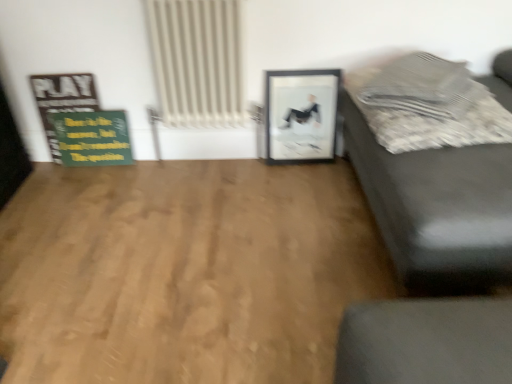
Question: Considering the relative sizes of textured gray pillow at upper right and matte black couch at right in the image provided, is textured gray pillow at upper right bigger than matte black couch at right?

Choices:
 (A) no
 (B) yes

Answer: (A)

Question: Does textured gray pillow at upper right have a greater width compared to matte black couch at right?

Choices:
 (A) no
 (B) yes

Answer: (A)

Question: Does textured gray pillow at upper right come behind matte black couch at right?

Choices:
 (A) yes
 (B) no

Answer: (A)

Question: Is textured gray pillow at upper right facing away from matte black couch at right?

Choices:
 (A) no
 (B) yes

Answer: (B)

Question: From a real-world perspective, is textured gray pillow at upper right physically above matte black couch at right?

Choices:
 (A) no
 (B) yes

Answer: (B)

Question: From the image's perspective, is textured gray pillow at upper right over matte black couch at right?

Choices:
 (A) yes
 (B) no

Answer: (A)

Question: Is textured gray pillow at upper right turned away from white textured radiator at upper center?

Choices:
 (A) yes
 (B) no

Answer: (B)

Question: Considering the relative sizes of textured gray pillow at upper right and white textured radiator at upper center in the image provided, is textured gray pillow at upper right wider than white textured radiator at upper center?

Choices:
 (A) no
 (B) yes

Answer: (B)

Question: Does textured gray pillow at upper right have a smaller size compared to white textured radiator at upper center?

Choices:
 (A) yes
 (B) no

Answer: (A)

Question: Is textured gray pillow at upper right taller than white textured radiator at upper center?

Choices:
 (A) yes
 (B) no

Answer: (B)

Question: Considering the relative sizes of textured gray pillow at upper right and white textured radiator at upper center in the image provided, is textured gray pillow at upper right thinner than white textured radiator at upper center?

Choices:
 (A) yes
 (B) no

Answer: (B)

Question: Does textured gray pillow at upper right touch white textured radiator at upper center?

Choices:
 (A) no
 (B) yes

Answer: (A)

Question: Could white textured radiator at upper center be considered to be inside matte black couch at right?

Choices:
 (A) yes
 (B) no

Answer: (B)